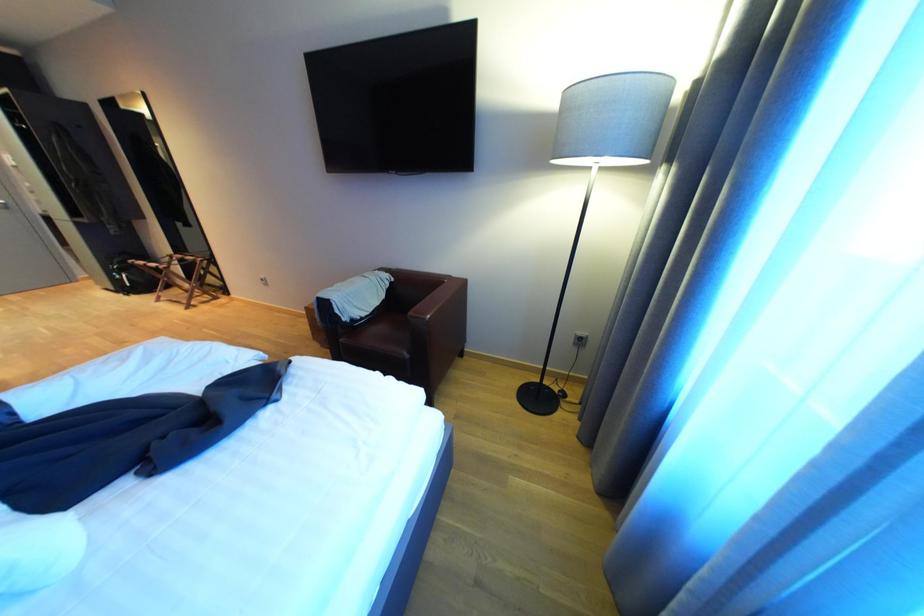
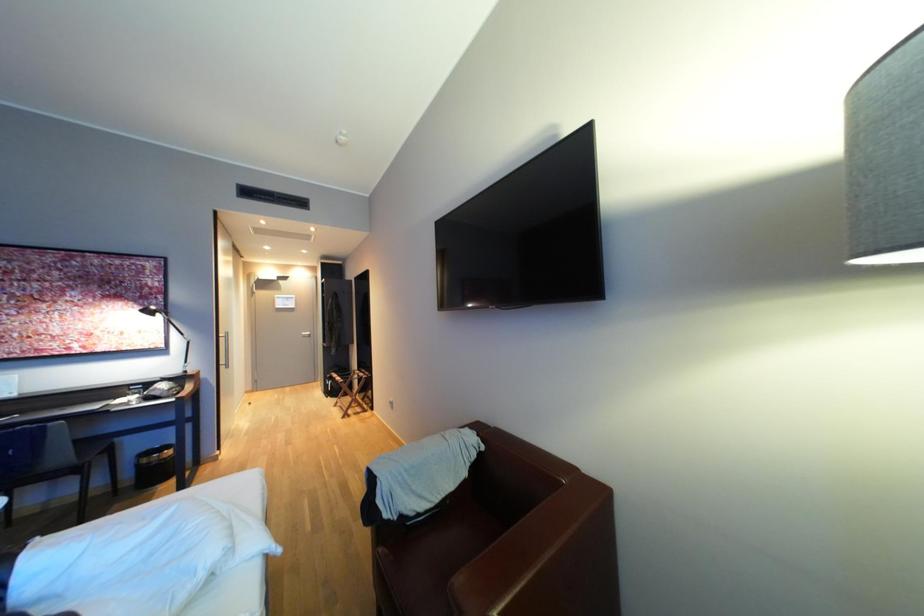
The first image is from the beginning of the video and the second image is from the end. How did the camera likely rotate when shooting the video?

The camera rotated toward left-up.